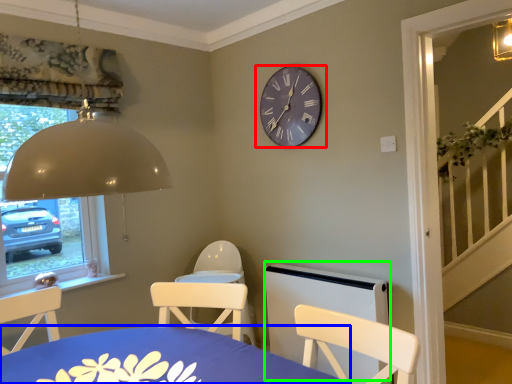
Question: Considering the real-world distances, which object is farthest from wall clock (highlighted by a red box)? table (highlighted by a blue box) or bed frame (highlighted by a green box)?

Choices:
 (A) table
 (B) bed frame

Answer: (A)